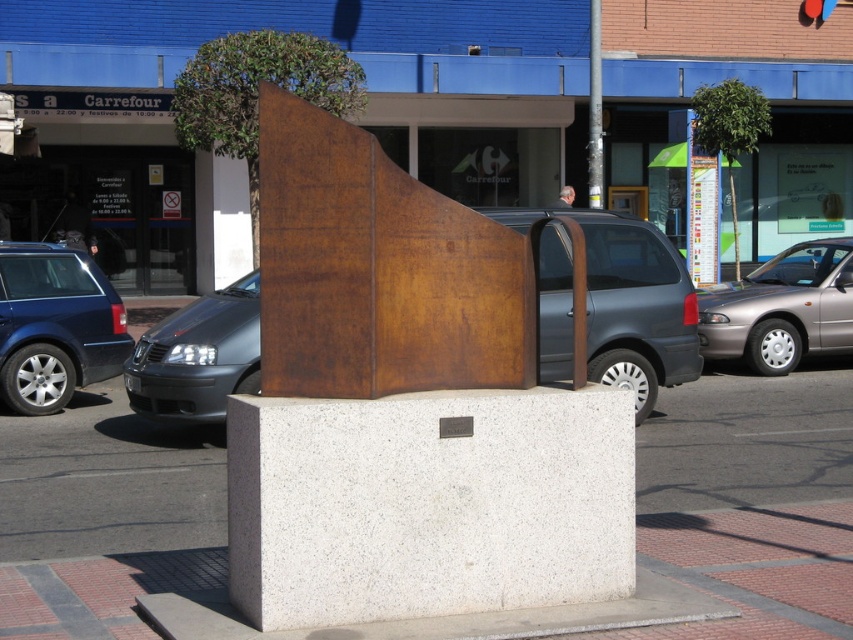
You are standing in front of the sculpture and want to take a photo of both the rusty metal sculpture at center and the matte black car at left. Which object should you focus on first to ensure both are in the frame?

You should focus on the rusty metal sculpture at center first since it is closer to you than the matte black car at left, ensuring both are in the frame by adjusting the camera angle accordingly.

You are a delivery person needing to park your truck, which is 10 meters long, near the matte brown van at center and the copper metal pole at center. Can your truck fit between them without touching either?

The matte brown van at center is larger than the copper metal pole at center, but the distance between them isn

You are standing in front of the sculpture and want to walk to the blue storefront. Which object should you pass first, the silver metallic car at right or the copper metal pole at center?

You should pass the copper metal pole at center first because the silver metallic car at right is located to the right of the copper metal pole at center, so the pole is closer to your starting position near the sculpture.